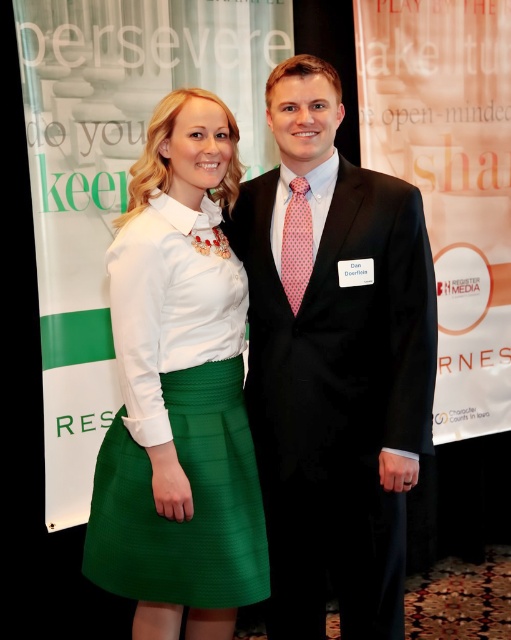
Can you confirm if matte black suit at center is positioned to the left of green textured skirt at center?

No, matte black suit at center is not to the left of green textured skirt at center.

The image size is (511, 640). I want to click on matte black suit at center, so click(x=334, y=362).

Find the location of `matte black suit at center`. matte black suit at center is located at coordinates pos(334,362).

You are a GUI agent. You are given a task and a screenshot of the screen. Output one action in this format:
    pyautogui.click(x=<x>, y=<y>)
    Task: Click on the matte black suit at center
    The height and width of the screenshot is (640, 511).
    Given the screenshot: What is the action you would take?
    pyautogui.click(x=334, y=362)